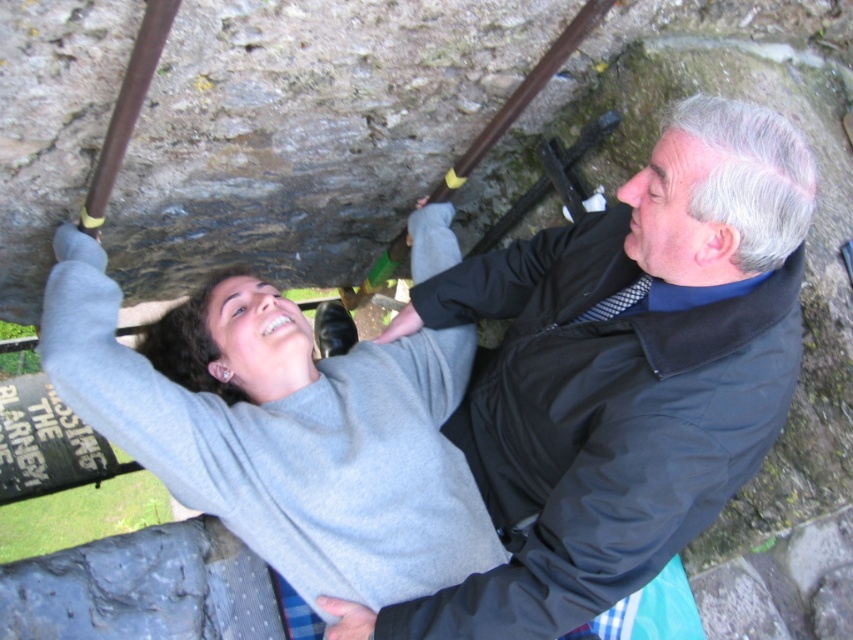
Question: Which point is farther to the camera?

Choices:
 (A) gray matte sweater at upper center
 (B) black smooth jacket at upper right

Answer: (A)

Question: Does black smooth jacket at upper right have a greater width compared to gray matte sweater at upper center?

Choices:
 (A) yes
 (B) no

Answer: (B)

Question: Which object is closer to the camera taking this photo?

Choices:
 (A) gray matte sweater at upper center
 (B) black smooth jacket at upper right

Answer: (B)

Question: Does black smooth jacket at upper right have a lesser width compared to gray matte sweater at upper center?

Choices:
 (A) yes
 (B) no

Answer: (A)

Question: Does black smooth jacket at upper right appear over gray matte sweater at upper center?

Choices:
 (A) no
 (B) yes

Answer: (A)

Question: Which object appears farthest from the camera in this image?

Choices:
 (A) gray matte sweater at upper center
 (B) black smooth jacket at upper right

Answer: (A)